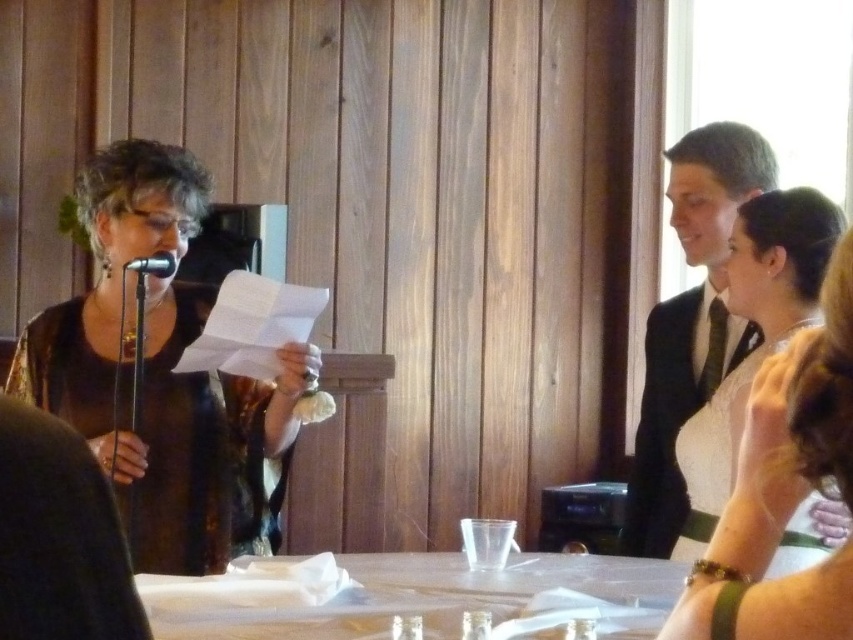
You are a guest at the event and want to place a small gift on the table where the white paper napkin at center is located. The gift requires a stable surface directly above the black metallic microphone at left. Can you place the gift there?

The white paper napkin at center is located below the black metallic microphone at left, so placing the gift directly above the microphone would not be possible since the napkin is below it and there might not be a surface there.

You are a photographer at the wedding reception. You need to capture a photo where both the matte black dress at left and the white paper napkin at center are visible. Which object should you ensure is closer to the camera to include both in the frame?

Since the matte black dress at left is taller than the white paper napkin at center, you should position the camera closer to the white paper napkin at center to ensure both objects are visible in the frame.